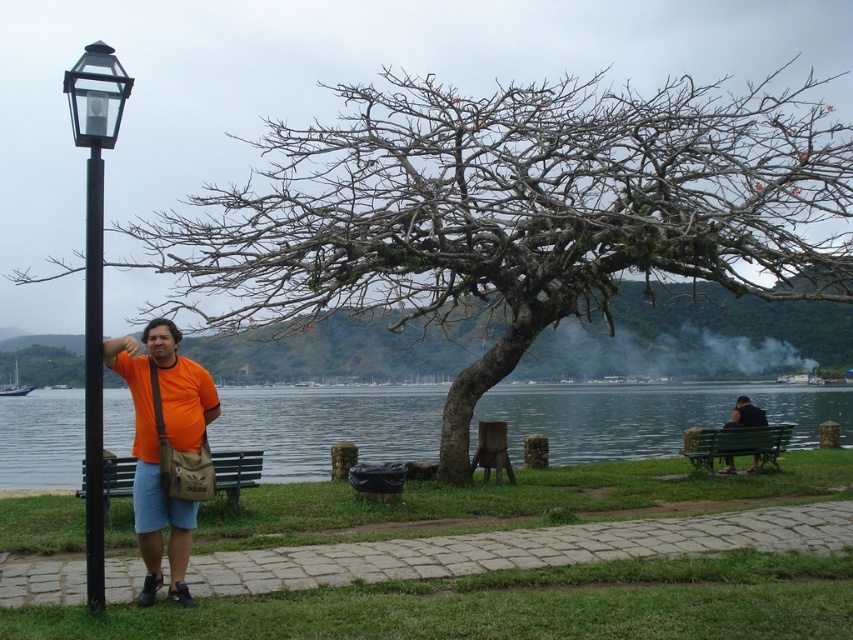
You are a photographer trying to capture the entire scene in one shot. Given that the green water at bench right and the black fabric person at right are both in your frame, which object occupies more horizontal space in the image?

The green water at bench right occupies more horizontal space than the black fabric person at right because its width surpasses the latter according to the description.

You are a photographer trying to capture a clear shot of the black metal lamp post at left and the black metal pole at left. Since both are positioned at the left side of the scene, which one is more likely to block the view of the other when framing your shot?

The black metal pole at left is behind the black metal lamp post at left, so the lamp post would block the view of the pole when framing the shot.